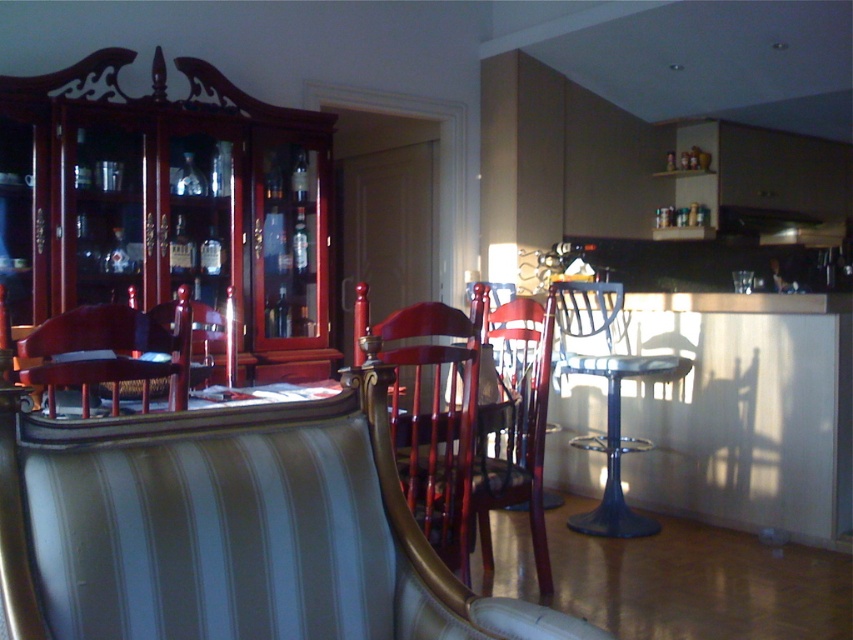
Who is lower down, glossy wood chair at center or matte wood chair at left?

glossy wood chair at center is lower down.

Is glossy wood chair at center thinner than matte wood chair at left?

Yes, glossy wood chair at center is thinner than matte wood chair at left.

Between point (457, 324) and point (109, 358), which one is positioned in front?

Point (109, 358)

Locate an element on the screen. glossy wood chair at center is located at coordinates (434, 420).

Can you confirm if wooden chair at center is smaller than glossy wood chair at center?

Actually, wooden chair at center might be larger than glossy wood chair at center.

What do you see at coordinates (469, 424) in the screenshot? I see `wooden chair at center` at bounding box center [469, 424].

This screenshot has width=853, height=640. Find the location of `wooden chair at center`. wooden chair at center is located at coordinates (469, 424).

Looking at this image, who is shorter, matte wood chair at left or metallic blue stool at right?

matte wood chair at left is shorter.

Can you confirm if matte wood chair at left is thinner than metallic blue stool at right?

Yes, matte wood chair at left is thinner than metallic blue stool at right.

Locate an element on the screen. The image size is (853, 640). matte wood chair at left is located at coordinates (109, 349).

The image size is (853, 640). I want to click on matte wood chair at left, so click(x=109, y=349).